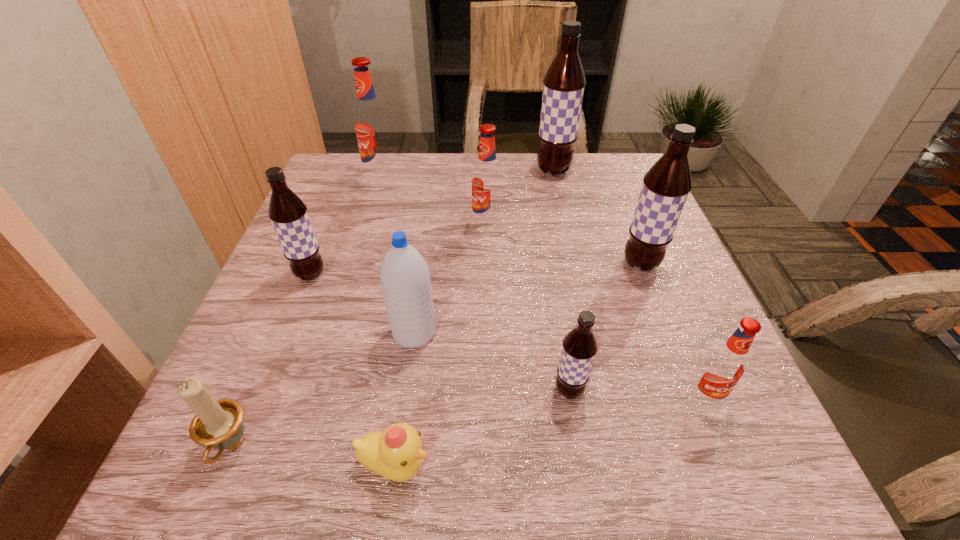
The width and height of the screenshot is (960, 540). What are the coordinates of `object at the near left corner` in the screenshot? It's located at (217, 424).

Identify the location of vacant space at the far edge of the desktop. This screenshot has width=960, height=540. (401, 189).

You are a GUI agent. You are given a task and a screenshot of the screen. Output one action in this format:
    pyautogui.click(x=<x>, y=<y>)
    Task: Click on the vacant space at the left edge of the desktop
    This screenshot has width=960, height=540.
    Given the screenshot: What is the action you would take?
    pyautogui.click(x=336, y=261)

I want to click on vacant space at the right edge of the desktop, so [x=689, y=363].

Find the location of `vacant region at the far left corner of the desktop`. vacant region at the far left corner of the desktop is located at coordinates (358, 154).

The width and height of the screenshot is (960, 540). I want to click on vacant space at the near right corner of the desktop, so click(735, 495).

This screenshot has height=540, width=960. I want to click on free space between the eighth nearest object and the biggest red root beer, so click(434, 202).

At what (x,y) coordinates should I click in order to perform the action: click on free space between the second biggest brown root beer and the leftmost root beer. Please return your answer as a coordinate pair (x, y). Looking at the image, I should click on (475, 269).

Locate an element on the screen. This screenshot has width=960, height=540. free space between the rightmost brown root beer and the second nearest red root beer is located at coordinates (564, 245).

Find the location of a particular element. The height and width of the screenshot is (540, 960). vacant area that lies between the smallest brown root beer and the candle_holder is located at coordinates (400, 419).